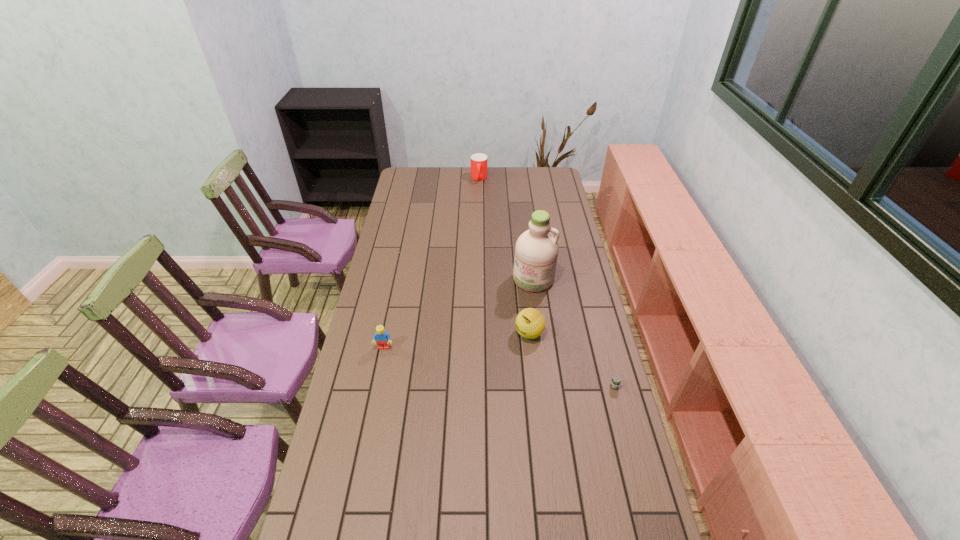
Locate an element on the screen. vacant region located on the front label of the fourth nearest object is located at coordinates (504, 349).

The width and height of the screenshot is (960, 540). I want to click on vacant space located on the front label of the fourth nearest object, so click(x=510, y=336).

Image resolution: width=960 pixels, height=540 pixels. I want to click on vacant region located 0.230m on the front label of the fourth nearest object, so click(x=512, y=332).

Locate an element on the screen. This screenshot has height=540, width=960. free space located on the side of the cup with the handle is located at coordinates (476, 219).

Locate an element on the screen. This screenshot has height=540, width=960. free point located 0.180m on the side of the cup with the handle is located at coordinates (477, 201).

Locate an element on the screen. blank space located 0.250m on the side of the cup with the handle is located at coordinates (477, 209).

Where is `vacant area situated 0.090m on the logo side of the softball`? vacant area situated 0.090m on the logo side of the softball is located at coordinates (501, 353).

Locate an element on the screen. This screenshot has width=960, height=540. vacant space located 0.070m on the logo side of the softball is located at coordinates (505, 350).

The height and width of the screenshot is (540, 960). In order to click on free location located 0.150m on the logo side of the softball in this screenshot , I will do `click(489, 362)`.

Locate an element on the screen. The image size is (960, 540). object present at the far edge is located at coordinates (479, 161).